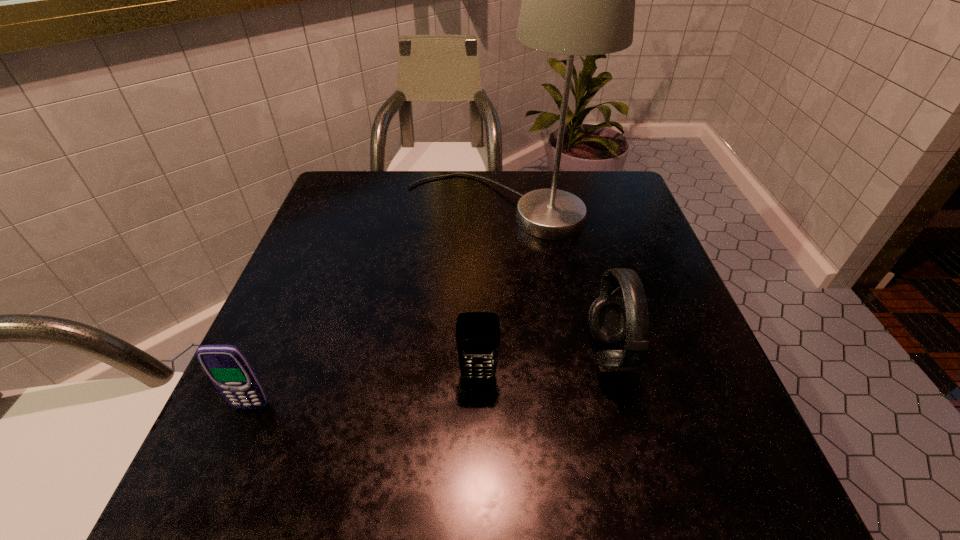
Identify the location of table lamp. (579, 0).

This screenshot has width=960, height=540. What are the coordinates of `the farthest object` in the screenshot? It's located at (579, 0).

The width and height of the screenshot is (960, 540). Identify the location of headset. (613, 320).

At what (x,y) coordinates should I click in order to perform the action: click on the farther cellular telephone. Please return your answer as a coordinate pair (x, y). This screenshot has width=960, height=540. Looking at the image, I should click on (477, 333).

Locate an element on the screen. The image size is (960, 540). the leftmost object is located at coordinates (227, 367).

Locate an element on the screen. This screenshot has height=540, width=960. the nearest object is located at coordinates point(227,367).

The image size is (960, 540). In order to click on free space located on the earcups of the headset in this screenshot , I will do `click(431, 354)`.

Locate an element on the screen. Image resolution: width=960 pixels, height=540 pixels. free space located 0.190m on the earcups of the headset is located at coordinates (482, 354).

This screenshot has height=540, width=960. What are the coordinates of `free spot located 0.050m on the earcups of the headset` in the screenshot? It's located at click(562, 354).

I want to click on free spot located on the screen of the farther cellular telephone, so tap(478, 468).